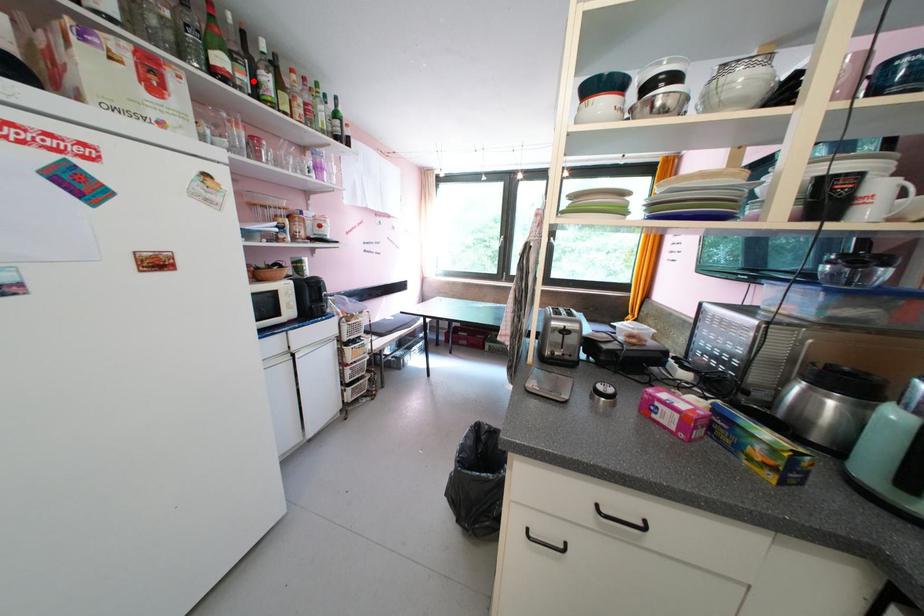
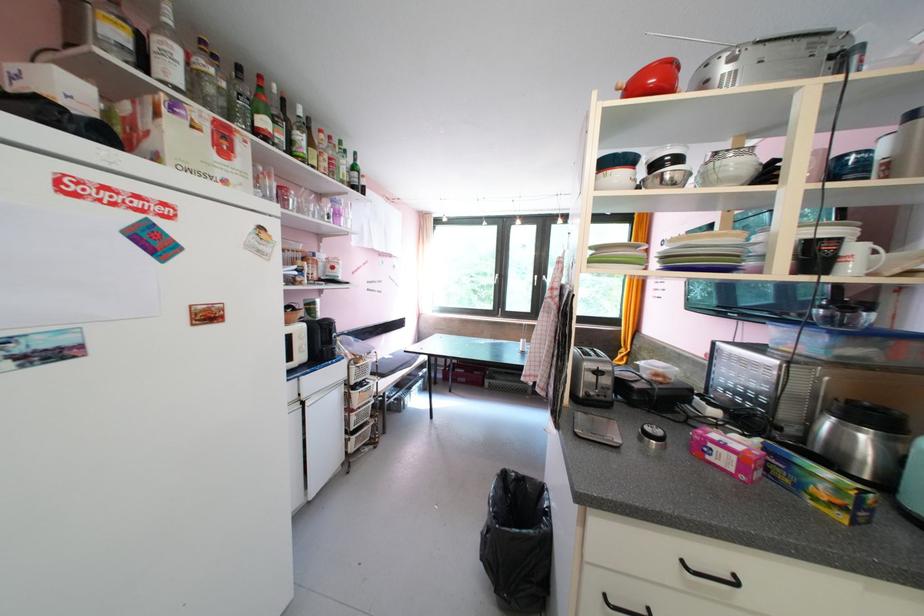
Where in the second image is the point corresponding to the highlighted location from the first image?

(290, 140)